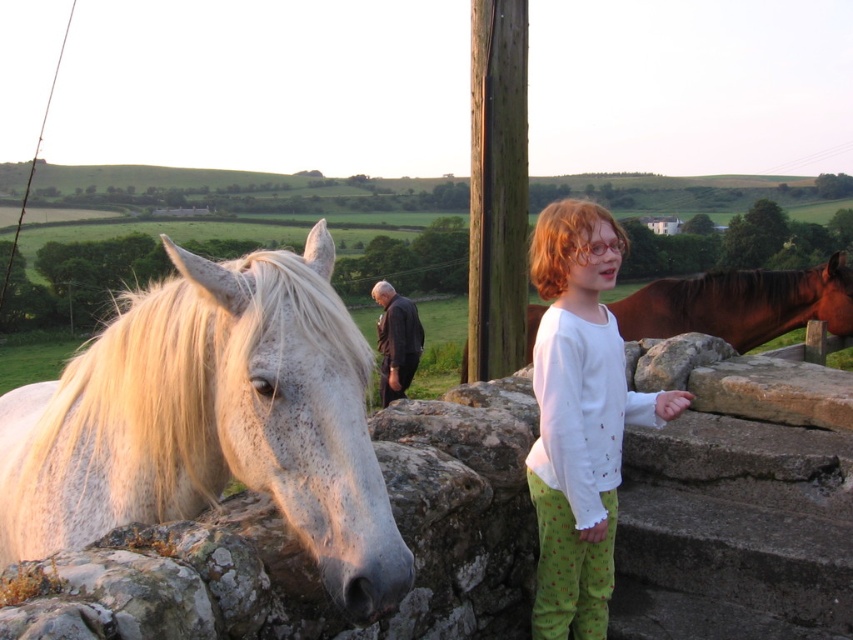
You are a photographer trying to capture the white cotton shirt at upper right and the shiny brown horse at right in the same frame. Based on their sizes, which object will appear smaller in the photo?

The white cotton shirt at upper right will appear smaller in the photo because its width is less than that of the shiny brown horse at right.

You are a photographer trying to capture the white speckled fur at left and the shiny brown horse at right in a single frame. Based on their heights, which object should you adjust your camera angle to focus on first?

The white speckled fur at left is taller than the shiny brown horse at right, so you should adjust your camera angle to focus on the white speckled fur at left first.

You are standing at the point marked as point (253, 400) in the image. If you want to take a photo of the white horse with the stone wall in the background, will the camera positioned at your current location be able to capture both the horse and the wall clearly in the frame?

The distance between the camera and point (253, 400) is 1.62 meters. Since the camera is positioned at the point, it can capture both the white horse and the stone wall in the frame as they are within the field of view.